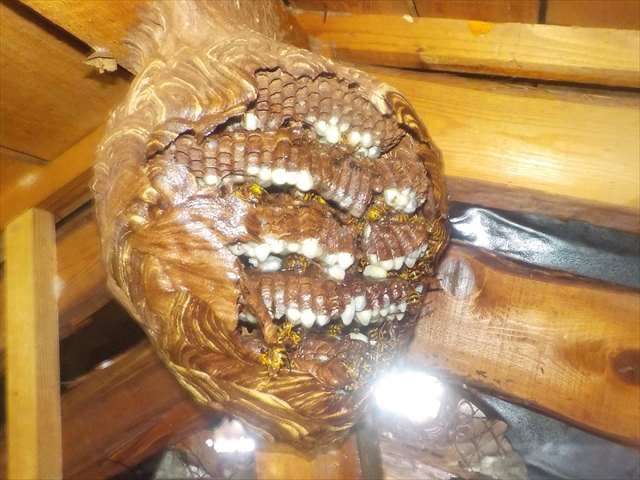
Where is `left wall`? The height and width of the screenshot is (480, 640). left wall is located at coordinates (120, 391).